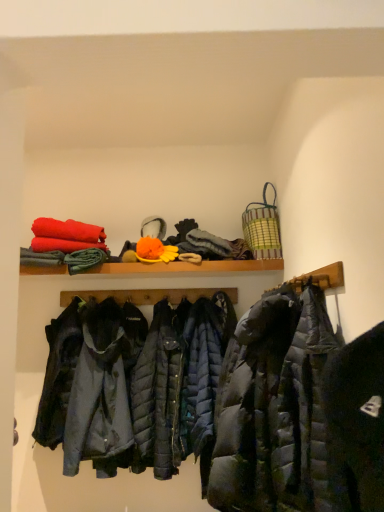
Question: Does dark gray quilted jacket at center have a greater width compared to wooden shelf at upper center?

Choices:
 (A) no
 (B) yes

Answer: (B)

Question: Does dark gray quilted jacket at center have a smaller size compared to wooden shelf at upper center?

Choices:
 (A) yes
 (B) no

Answer: (B)

Question: Can you confirm if dark gray quilted jacket at center is positioned to the left of wooden shelf at upper center?

Choices:
 (A) yes
 (B) no

Answer: (B)

Question: Does dark gray quilted jacket at center lie in front of wooden shelf at upper center?

Choices:
 (A) yes
 (B) no

Answer: (A)

Question: Is dark gray quilted jacket at center oriented away from wooden shelf at upper center?

Choices:
 (A) no
 (B) yes

Answer: (A)

Question: Would you say wooden shelf at upper center is part of dark gray quilted jacket at center's contents?

Choices:
 (A) yes
 (B) no

Answer: (B)

Question: Considering the relative sizes of wooden shelf at upper center and dark gray quilted jacket at center in the image provided, is wooden shelf at upper center taller than dark gray quilted jacket at center?

Choices:
 (A) no
 (B) yes

Answer: (A)

Question: Considering the relative sizes of wooden shelf at upper center and dark gray quilted jacket at center in the image provided, is wooden shelf at upper center bigger than dark gray quilted jacket at center?

Choices:
 (A) no
 (B) yes

Answer: (A)

Question: Is wooden shelf at upper center far from dark gray quilted jacket at center?

Choices:
 (A) no
 (B) yes

Answer: (A)

Question: Is wooden shelf at upper center behind dark gray quilted jacket at center?

Choices:
 (A) yes
 (B) no

Answer: (A)

Question: Considering the relative sizes of wooden shelf at upper center and dark gray quilted jacket at center in the image provided, is wooden shelf at upper center thinner than dark gray quilted jacket at center?

Choices:
 (A) yes
 (B) no

Answer: (A)

Question: Considering the relative sizes of wooden shelf at upper center and dark gray quilted jacket at center in the image provided, is wooden shelf at upper center wider than dark gray quilted jacket at center?

Choices:
 (A) yes
 (B) no

Answer: (B)

Question: Is green striped woven basket at upper right in contact with wooden shelf at upper center?

Choices:
 (A) yes
 (B) no

Answer: (B)